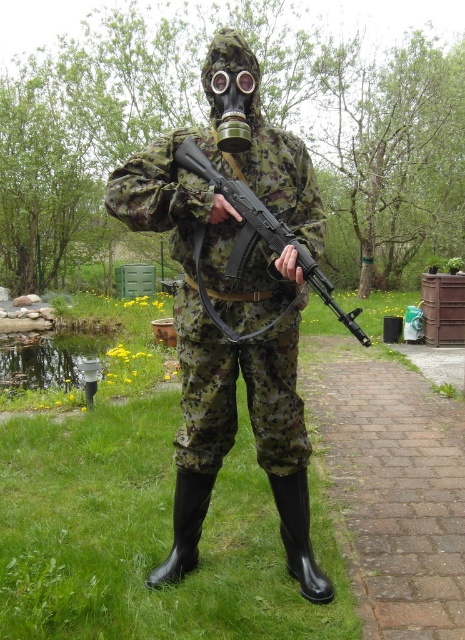
Describe the element at coordinates (232, 316) in the screenshot. The width and height of the screenshot is (465, 640). I see `camouflage fabric uniform at center` at that location.

Locate an element on the screen. camouflage fabric uniform at center is located at coordinates (232, 316).